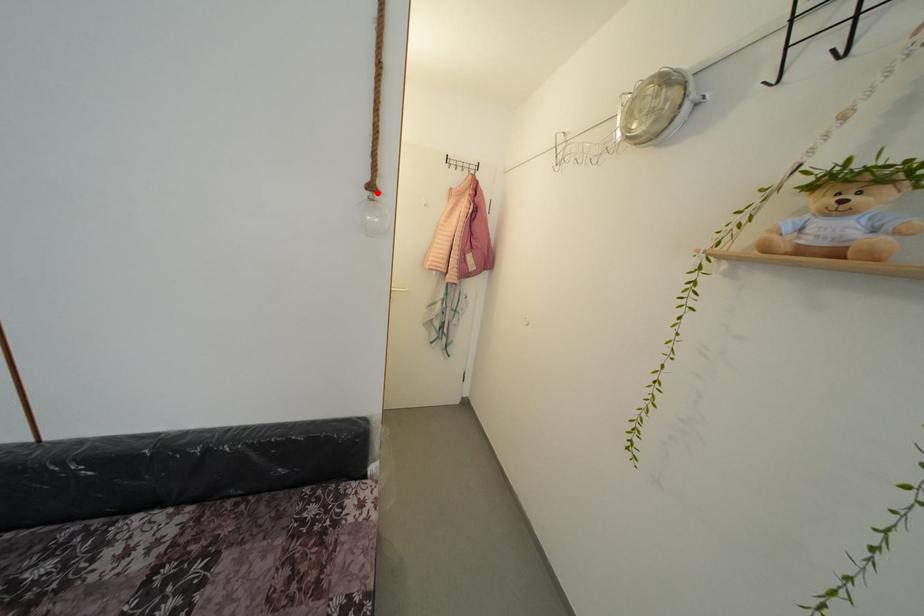
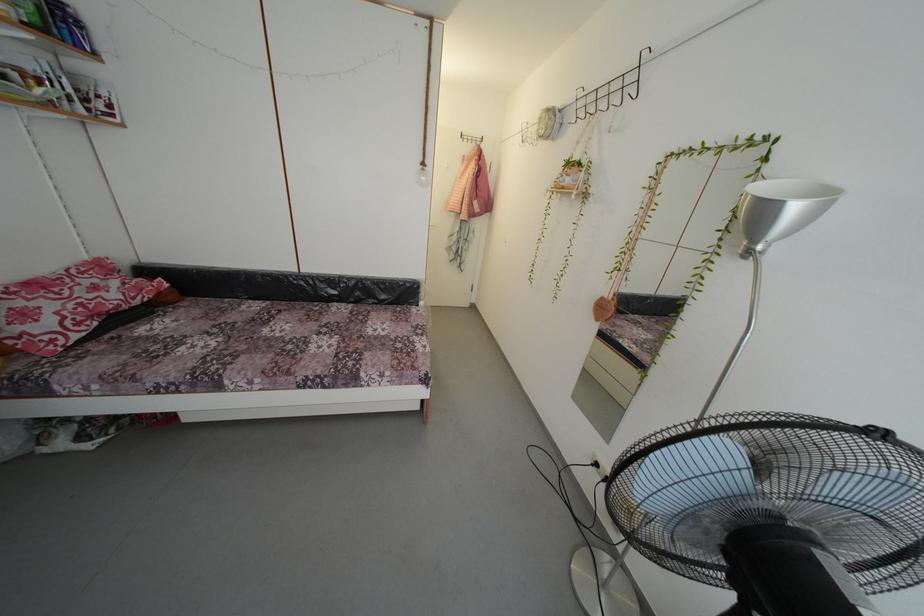
Locate, in the second image, the point that corresponds to the highlighted location in the first image.

(429, 169)